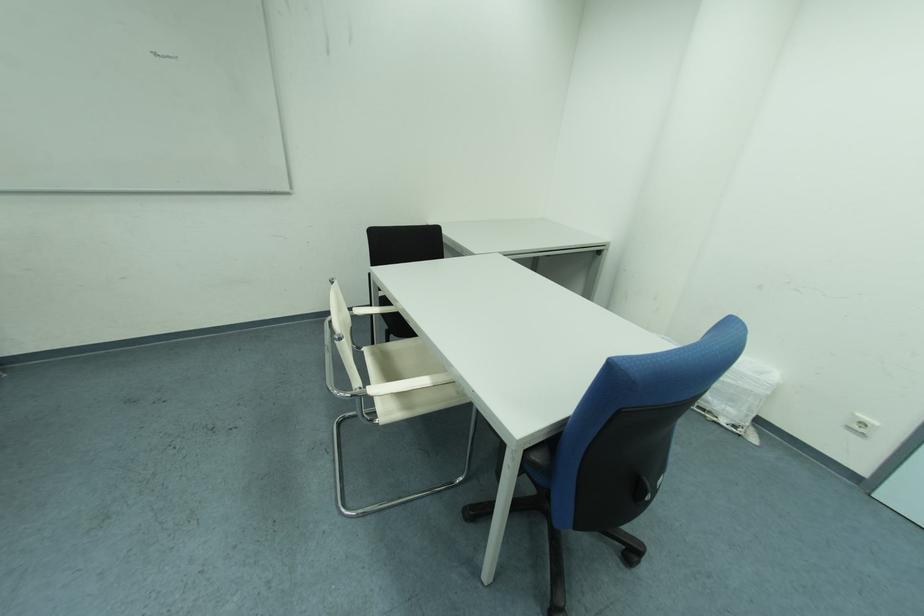
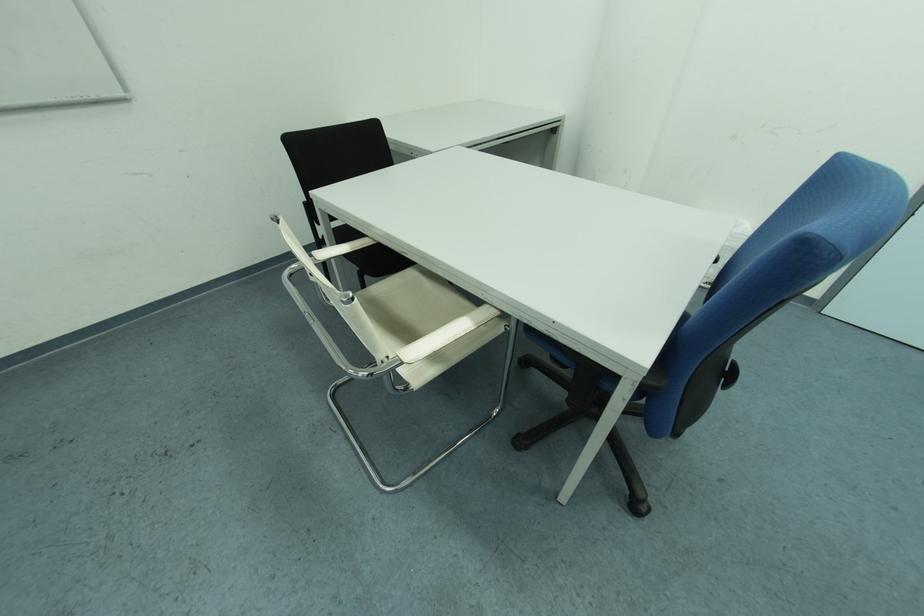
Locate, in the second image, the point that corresponds to (396,344) in the first image.

(372, 286)